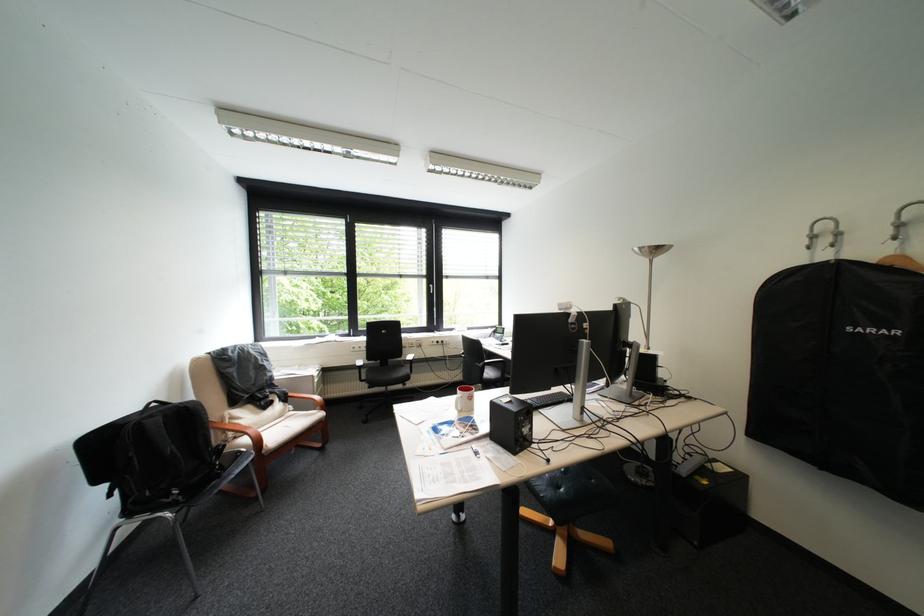
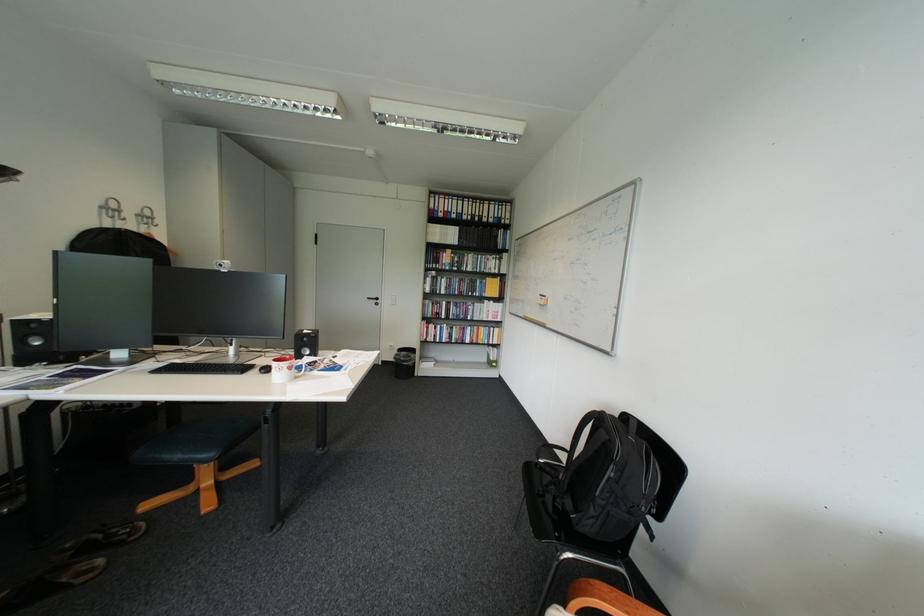
Locate, in the second image, the point that corresponds to the point at 470,389 in the first image.

(299, 362)